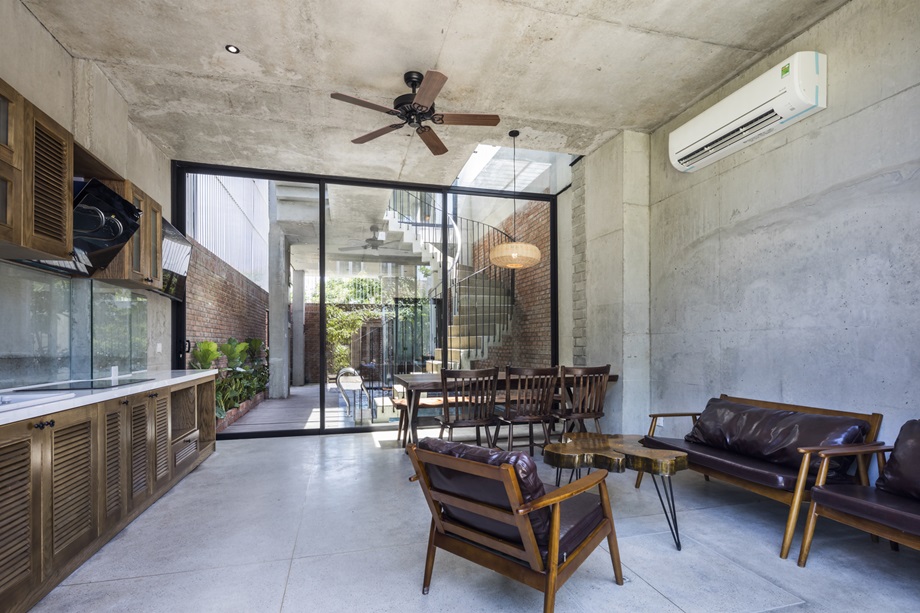
Locate an element on the screen. The width and height of the screenshot is (920, 613). hanging ceiling light is located at coordinates (510, 256).